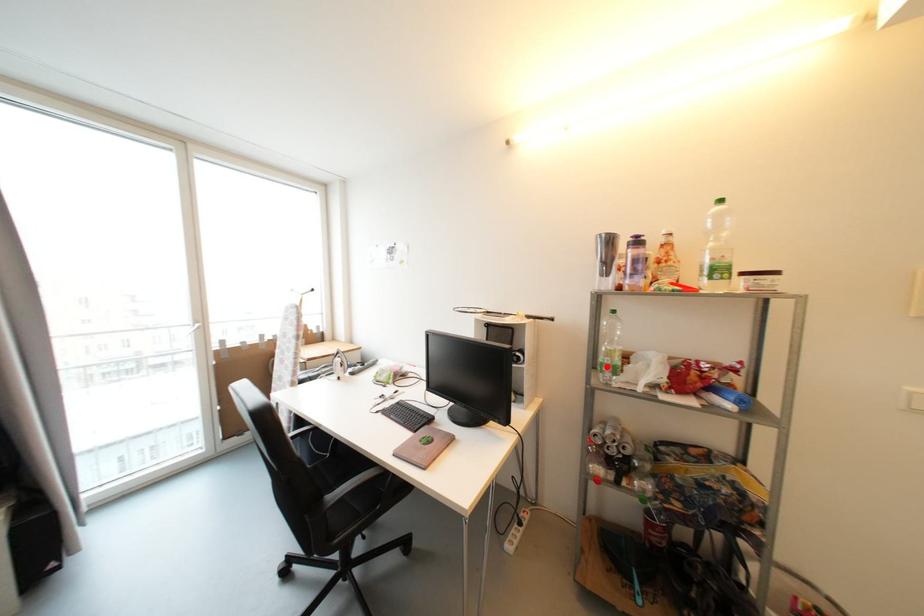
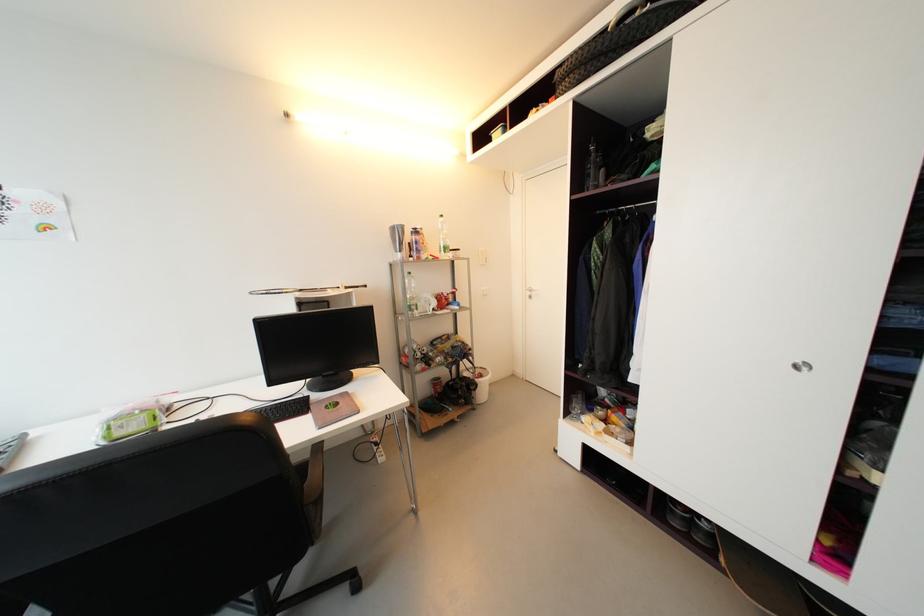
Locate, in the second image, the point that corresponds to the highlighted location in the first image.

(415, 308)